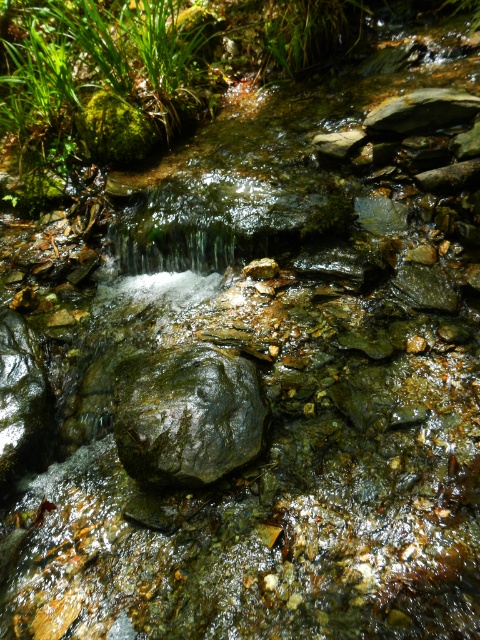
What do you see at coordinates (188, 413) in the screenshot? This screenshot has width=480, height=640. I see `shiny dark rock at center` at bounding box center [188, 413].

Is point (123, 374) less distant than point (47, 394)?

Yes, it is in front of point (47, 394).

Identify the location of shiny dark rock at center. (188, 413).